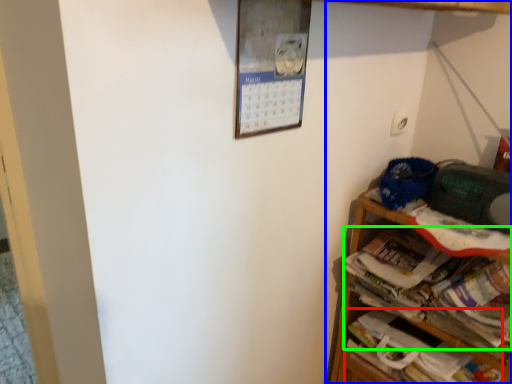
Question: Which object is the farthest from book (highlighted by a red box)? Choose among these: shelf (highlighted by a blue box) or magazine (highlighted by a green box).

Choices:
 (A) shelf
 (B) magazine

Answer: (B)